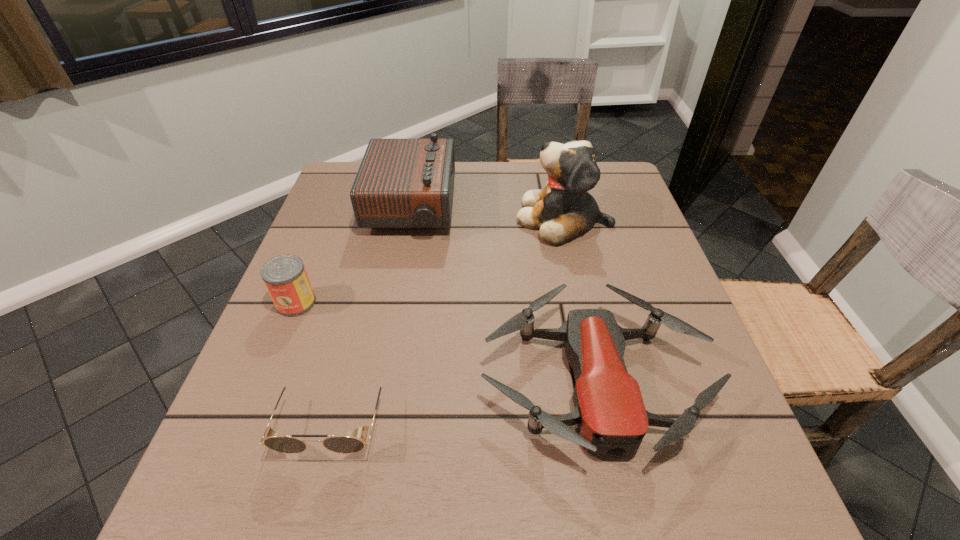
Where is `free space between the sunglasses and the tallest object`? The width and height of the screenshot is (960, 540). free space between the sunglasses and the tallest object is located at coordinates (448, 319).

In order to click on vacant space that's between the leftmost object and the drone in this screenshot , I will do `click(445, 341)`.

You are a GUI agent. You are given a task and a screenshot of the screen. Output one action in this format:
    pyautogui.click(x=<x>, y=<y>)
    Task: Click on the free area in between the drone and the fourth shortest object
    
    Given the screenshot: What is the action you would take?
    pyautogui.click(x=503, y=294)

This screenshot has width=960, height=540. I want to click on free area in between the drone and the fourth shortest object, so point(503,294).

Locate an element on the screen. This screenshot has width=960, height=540. free area in between the drone and the sunglasses is located at coordinates (464, 400).

Where is `unoccupied area between the leftmost object and the sunglasses`? unoccupied area between the leftmost object and the sunglasses is located at coordinates (315, 361).

At what (x,y) coordinates should I click in order to perform the action: click on vacant region between the sunglasses and the tallest object. Please return your answer as a coordinate pair (x, y). The image size is (960, 540). Looking at the image, I should click on (448, 319).

What are the coordinates of `object identified as the second closest to the radio receiver` in the screenshot? It's located at (564, 209).

At what (x,y) coordinates should I click in order to perform the action: click on object that can be found as the closest to the drone. Please return your answer as a coordinate pair (x, y). This screenshot has width=960, height=540. Looking at the image, I should click on (340, 444).

The height and width of the screenshot is (540, 960). Identify the location of free space that satisfies the following two spatial constraints: 1. on the tuning display of the radio receiver; 2. on the front lenses of the sunglasses. (371, 419).